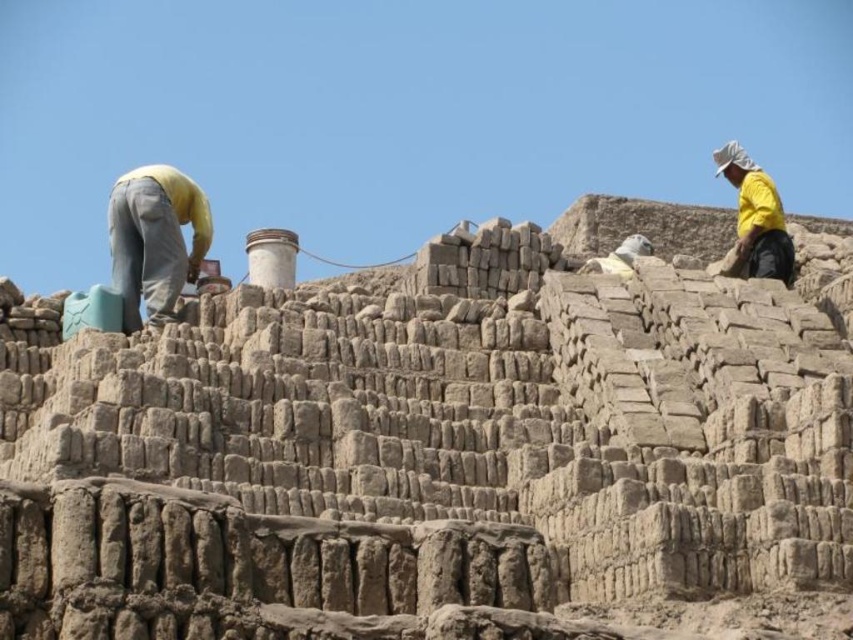
Question: Which object appears closest to the camera in this image?

Choices:
 (A) yellow fabric at center
 (B) yellow matte shirt at upper right

Answer: (A)

Question: Is yellow fabric at center smaller than yellow matte shirt at upper right?

Choices:
 (A) yes
 (B) no

Answer: (B)

Question: Is yellow fabric at center closer to camera compared to yellow matte shirt at upper right?

Choices:
 (A) yes
 (B) no

Answer: (A)

Question: Considering the relative positions of yellow fabric at center and yellow matte shirt at upper right in the image provided, where is yellow fabric at center located with respect to yellow matte shirt at upper right?

Choices:
 (A) right
 (B) left

Answer: (B)